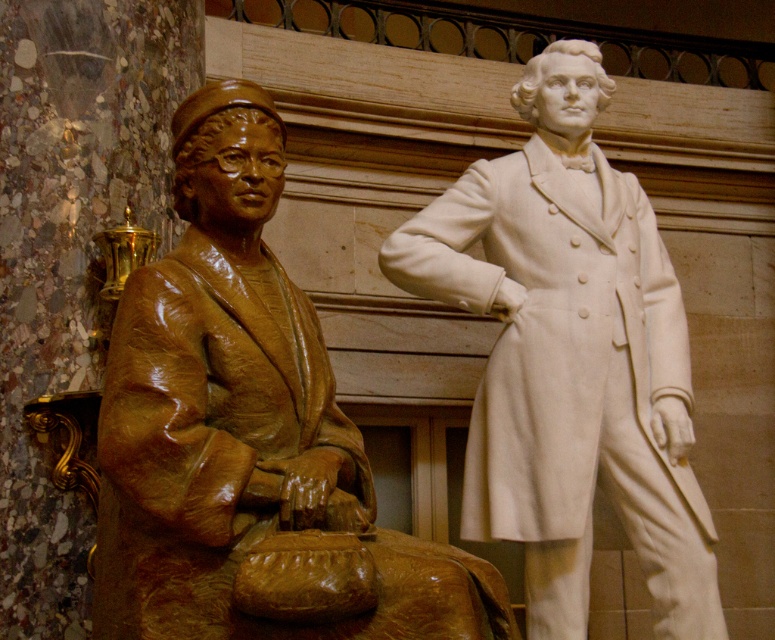
Between bronze statue at left and white marble statue at right, which one is positioned higher?

white marble statue at right

Can you confirm if bronze statue at left is smaller than white marble statue at right?

Indeed, bronze statue at left has a smaller size compared to white marble statue at right.

At what (x,y) coordinates should I click in order to perform the action: click on bronze statue at left. Please return your answer as a coordinate pair (x, y). This screenshot has width=775, height=640. Looking at the image, I should click on (248, 433).